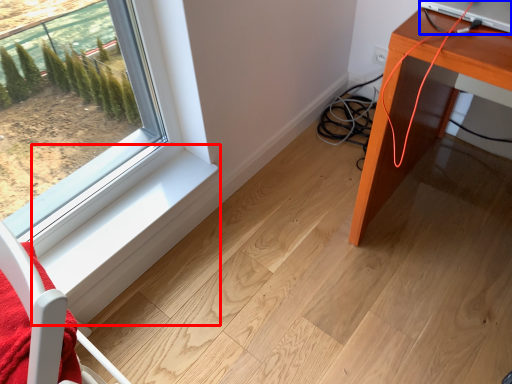
Question: Which of the following is the closest to the observer, window sill (highlighted by a red box) or desktop computer (highlighted by a blue box)?

Choices:
 (A) window sill
 (B) desktop computer

Answer: (B)